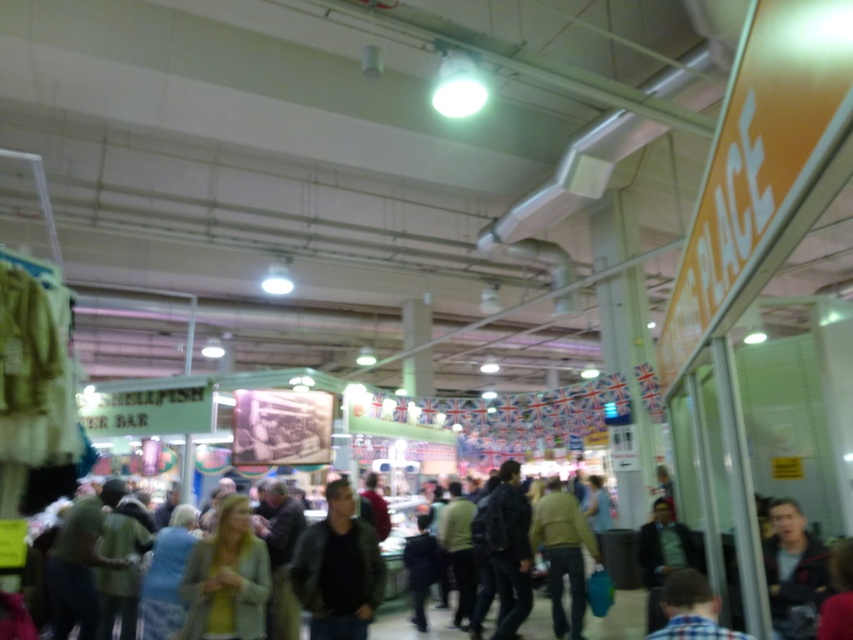
Can you confirm if dark blue jacket at lower right is taller than plaid shirt at lower right?

Yes, dark blue jacket at lower right is taller than plaid shirt at lower right.

The height and width of the screenshot is (640, 853). Find the location of `dark blue jacket at lower right`. dark blue jacket at lower right is located at coordinates (793, 572).

Image resolution: width=853 pixels, height=640 pixels. I want to click on dark blue jacket at lower right, so click(793, 572).

Which is in front, point (215, 605) or point (669, 632)?

Point (669, 632) is in front.

Is light green fabric jacket at center behind plaid shirt at lower right?

Yes, it is behind plaid shirt at lower right.

Is point (210, 604) positioned in front of point (741, 636)?

That is False.

Identify the location of light green fabric jacket at center. The width and height of the screenshot is (853, 640). (227, 579).

Does dark brown leather jacket at center have a lesser width compared to dark gray jacket at center?

No, dark brown leather jacket at center is not thinner than dark gray jacket at center.

Is dark brown leather jacket at center closer to camera compared to dark gray jacket at center?

Yes.

The height and width of the screenshot is (640, 853). What do you see at coordinates (338, 570) in the screenshot?
I see `dark brown leather jacket at center` at bounding box center [338, 570].

You are a GUI agent. You are given a task and a screenshot of the screen. Output one action in this format:
    pyautogui.click(x=<x>, y=<y>)
    Task: Click on the dark brown leather jacket at center
    This screenshot has width=853, height=640.
    Given the screenshot: What is the action you would take?
    click(338, 570)